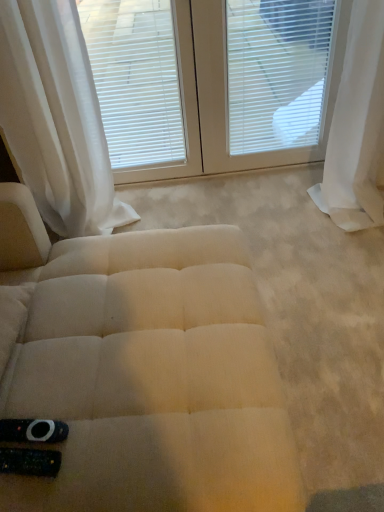
Image resolution: width=384 pixels, height=512 pixels. In order to click on vacant area that lies between white sheer curtain at right, the first curtain viewed from the right, and white plastic blinds at upper center in this screenshot , I will do `click(283, 194)`.